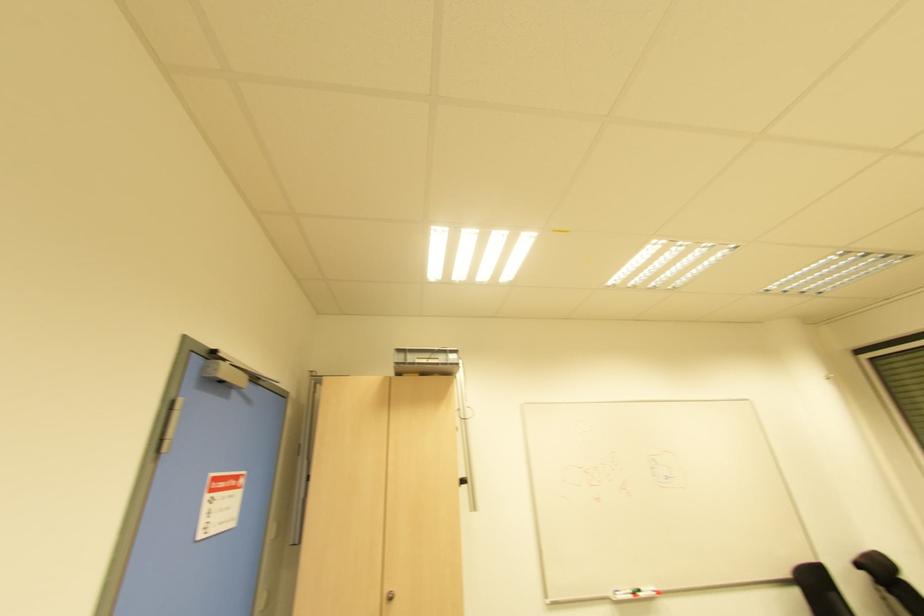
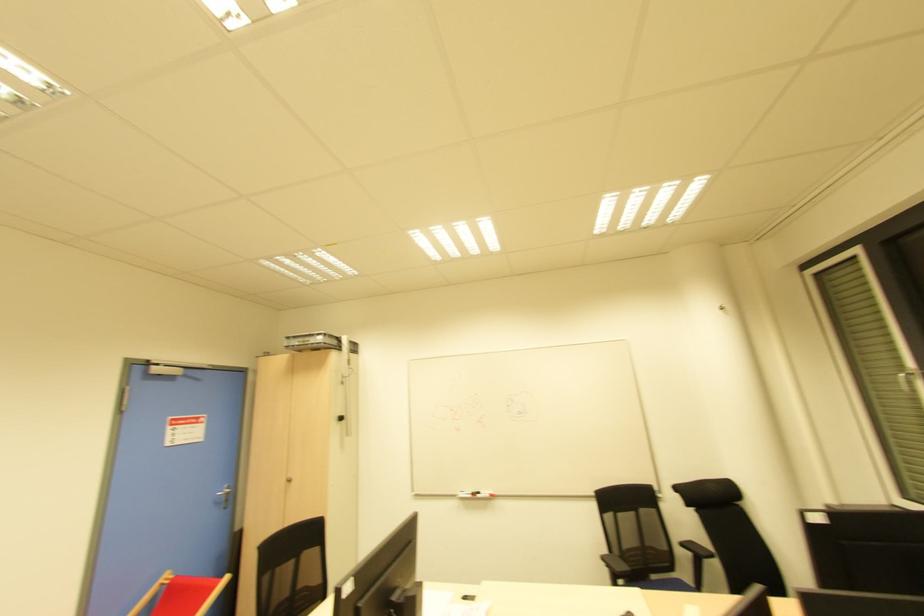
Locate, in the second image, the point that corresponds to pixel 396 365 in the first image.

(286, 347)